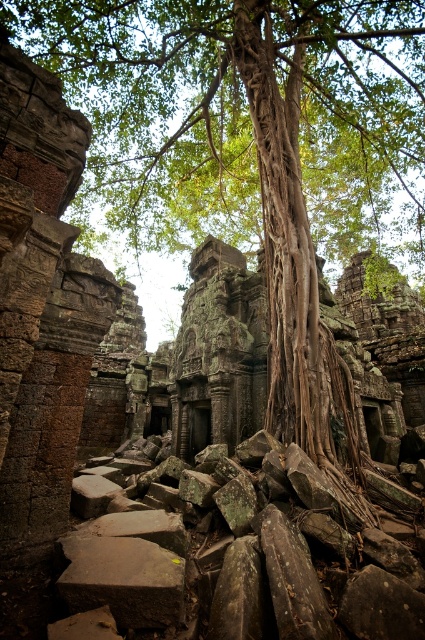
You are an archaeologist standing at the entrance of the ancient stone structure. You need to locate the brown rough tree trunk at center for your research. According to the coordinates provided, where exactly would you find it?

The brown rough tree trunk at center is located at coordinates point (244, 118).

You are an archaeologist examining the ancient stone structure. You notice the brown rough tree trunk at center and the brown rough stone at lower center. Which object has a larger size?

The brown rough tree trunk at center is bigger than the brown rough stone at lower center.

You are an archaeologist examining the ancient stone structure. You notice the brown rough tree trunk at center and the brown rough stone at lower center. Which object is closer to you?

The brown rough tree trunk at center is closer to you as it is positioned further to the viewer than the brown rough stone at lower center.